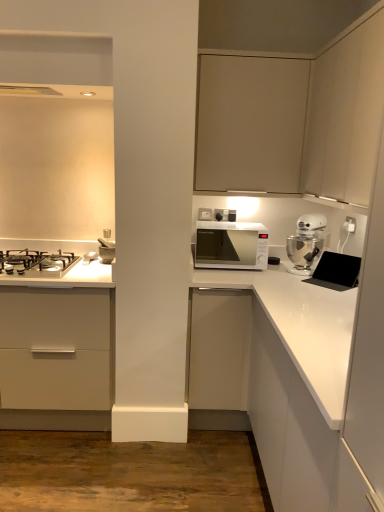
Question: From a real-world perspective, is white glossy countertop at lower left, the second countertop when ordered from bottom to top, on white plastic electric outlet at upper right?

Choices:
 (A) no
 (B) yes

Answer: (A)

Question: From the image's perspective, is white glossy countertop at lower left, the second countertop when ordered from bottom to top, located beneath white plastic electric outlet at upper right?

Choices:
 (A) yes
 (B) no

Answer: (A)

Question: Is white glossy countertop at lower left, the second countertop when ordered from bottom to top, at the left side of white plastic electric outlet at upper right?

Choices:
 (A) yes
 (B) no

Answer: (A)

Question: Can we say white glossy countertop at lower left, which is the 1th countertop from top to bottom, lies outside white plastic electric outlet at upper right?

Choices:
 (A) no
 (B) yes

Answer: (B)

Question: Is white glossy countertop at lower left, which is the 1th countertop from top to bottom, closer to the viewer compared to white plastic electric outlet at upper right?

Choices:
 (A) yes
 (B) no

Answer: (A)

Question: Can white plastic electric outlet at upper right be found inside white glossy countertop at lower left, which is the 1th countertop from top to bottom?

Choices:
 (A) yes
 (B) no

Answer: (B)

Question: Is white glossy countertop at lower left, arranged as the first countertop when viewed from the left, at the back of matte beige cabinet at upper center, the third cabinetry from the top?

Choices:
 (A) yes
 (B) no

Answer: (B)

Question: Does matte beige cabinet at upper center, the third cabinetry from the top, lie behind white glossy countertop at lower left, the second countertop when ordered from bottom to top?

Choices:
 (A) no
 (B) yes

Answer: (A)

Question: Considering the relative sizes of matte beige cabinet at upper center, the 3th cabinetry from the bottom, and white glossy countertop at lower left, arranged as the first countertop when viewed from the left, in the image provided, is matte beige cabinet at upper center, the 3th cabinetry from the bottom, thinner than white glossy countertop at lower left, arranged as the first countertop when viewed from the left,?

Choices:
 (A) yes
 (B) no

Answer: (B)

Question: Is matte beige cabinet at upper center, the third cabinetry from the top, to the left of white glossy countertop at lower left, which is counted as the second countertop, starting from the right, from the viewer's perspective?

Choices:
 (A) yes
 (B) no

Answer: (B)

Question: Considering the relative sizes of matte beige cabinet at upper center, the 3th cabinetry from the bottom, and white glossy countertop at lower left, the second countertop when ordered from bottom to top, in the image provided, is matte beige cabinet at upper center, the 3th cabinetry from the bottom, shorter than white glossy countertop at lower left, the second countertop when ordered from bottom to top,?

Choices:
 (A) yes
 (B) no

Answer: (B)

Question: From the image's perspective, is matte beige cabinet at upper center, the third cabinetry from the top, below white glossy countertop at lower left, the second countertop when ordered from bottom to top?

Choices:
 (A) no
 (B) yes

Answer: (A)

Question: Does white plastic electric outlet at upper right have a lesser height compared to matte beige cabinet at upper center, the third cabinetry from the top?

Choices:
 (A) no
 (B) yes

Answer: (B)